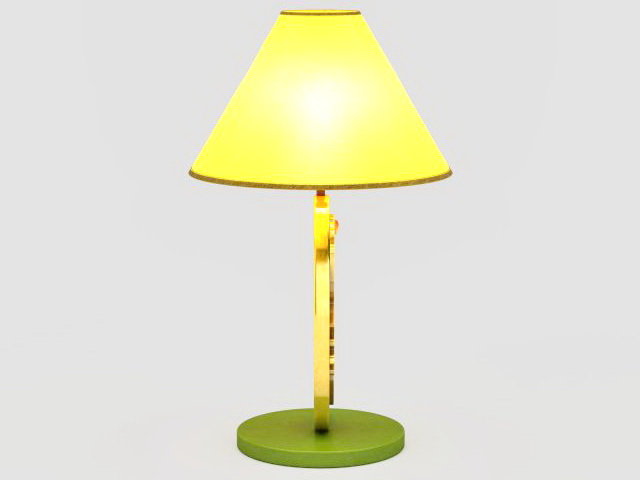
Locate an element on the screen. This screenshot has width=640, height=480. lamp base is located at coordinates (362, 442).